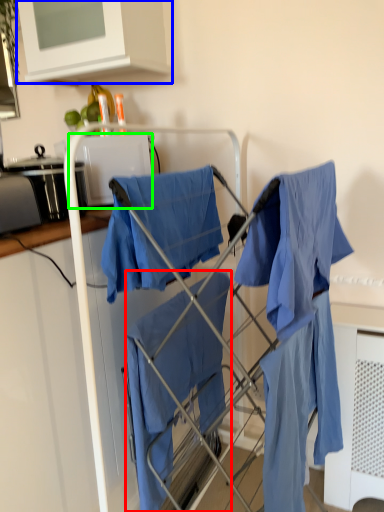
Question: Which is farther away from cloak (highlighted by a red box)? cabinetry (highlighted by a blue box) or appliance (highlighted by a green box)?

Choices:
 (A) cabinetry
 (B) appliance

Answer: (A)